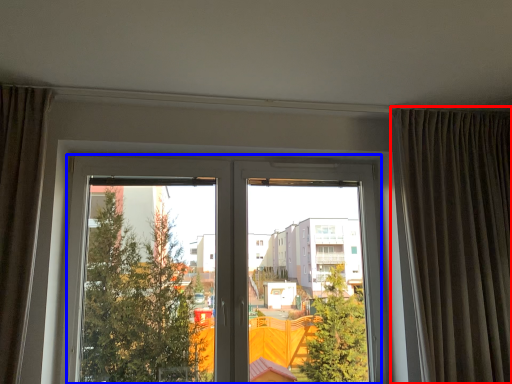
Question: Among these objects, which one is farthest to the camera, curtain (highlighted by a red box) or window (highlighted by a blue box)?

Choices:
 (A) curtain
 (B) window

Answer: (B)